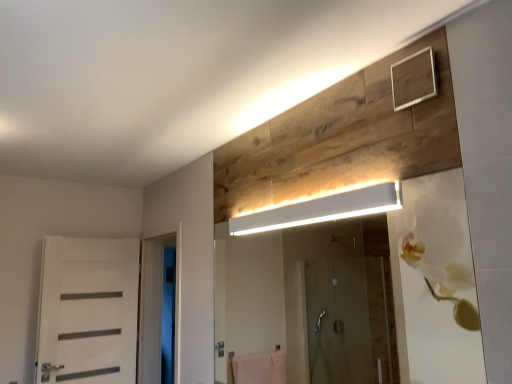
Question: Can you confirm if white matte rectangular light fixture at upper center is smaller than white glossy door at left?

Choices:
 (A) yes
 (B) no

Answer: (A)

Question: Can you confirm if white matte rectangular light fixture at upper center is thinner than white glossy door at left?

Choices:
 (A) yes
 (B) no

Answer: (A)

Question: Would you consider white matte rectangular light fixture at upper center to be distant from white glossy door at left?

Choices:
 (A) no
 (B) yes

Answer: (B)

Question: Does white matte rectangular light fixture at upper center have a greater height compared to white glossy door at left?

Choices:
 (A) no
 (B) yes

Answer: (A)

Question: Does white matte rectangular light fixture at upper center have a lesser height compared to white glossy door at left?

Choices:
 (A) yes
 (B) no

Answer: (A)

Question: From a real-world perspective, is white matte rectangular light fixture at upper center positioned under white glossy door at left based on gravity?

Choices:
 (A) yes
 (B) no

Answer: (B)

Question: From a real-world perspective, is white matte rectangular light fixture at upper center under white matte door at left?

Choices:
 (A) yes
 (B) no

Answer: (B)

Question: From the image's perspective, is white matte rectangular light fixture at upper center above white matte door at left?

Choices:
 (A) yes
 (B) no

Answer: (A)

Question: Is white matte rectangular light fixture at upper center oriented towards white matte door at left?

Choices:
 (A) no
 (B) yes

Answer: (A)

Question: Is white matte rectangular light fixture at upper center bigger than white matte door at left?

Choices:
 (A) yes
 (B) no

Answer: (B)

Question: Can we say white matte rectangular light fixture at upper center lies outside white matte door at left?

Choices:
 (A) yes
 (B) no

Answer: (A)

Question: Can you confirm if white matte rectangular light fixture at upper center is shorter than white matte door at left?

Choices:
 (A) yes
 (B) no

Answer: (A)

Question: Is the position of white glossy door at left more distant than that of white matte door at left?

Choices:
 (A) no
 (B) yes

Answer: (A)